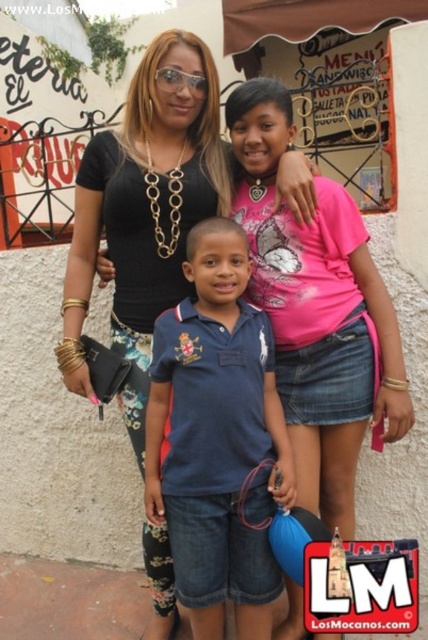
Who is higher up, pink matte shirt at center or black matte shirt at center?

Positioned higher is black matte shirt at center.

Who is more distant from viewer, (291, 288) or (184, 64)?

Positioned behind is point (184, 64).

Does point (267, 134) lie behind point (211, 182)?

No, it is not.

Where is `pink matte shirt at center`? Image resolution: width=428 pixels, height=640 pixels. pink matte shirt at center is located at coordinates (318, 312).

Consider the image. Does blue cotton polo shirt at center have a lesser width compared to pink matte shirt at center?

Yes.

Does blue cotton polo shirt at center appear over pink matte shirt at center?

No, blue cotton polo shirt at center is not above pink matte shirt at center.

At what (x,y) coordinates should I click in order to perform the action: click on blue cotton polo shirt at center. Please return your answer as a coordinate pair (x, y). The width and height of the screenshot is (428, 640). Looking at the image, I should click on (217, 440).

Does point (193, 570) lie in front of point (162, 145)?

Yes, point (193, 570) is closer to viewer.

Measure the distance between point (234, 349) and camera.

The distance of point (234, 349) from camera is 10.22 feet.

Does point (261, 577) come in front of point (186, 288)?

Yes, it is in front of point (186, 288).

Find the location of `blue cotton polo shirt at center`. blue cotton polo shirt at center is located at coordinates (217, 440).